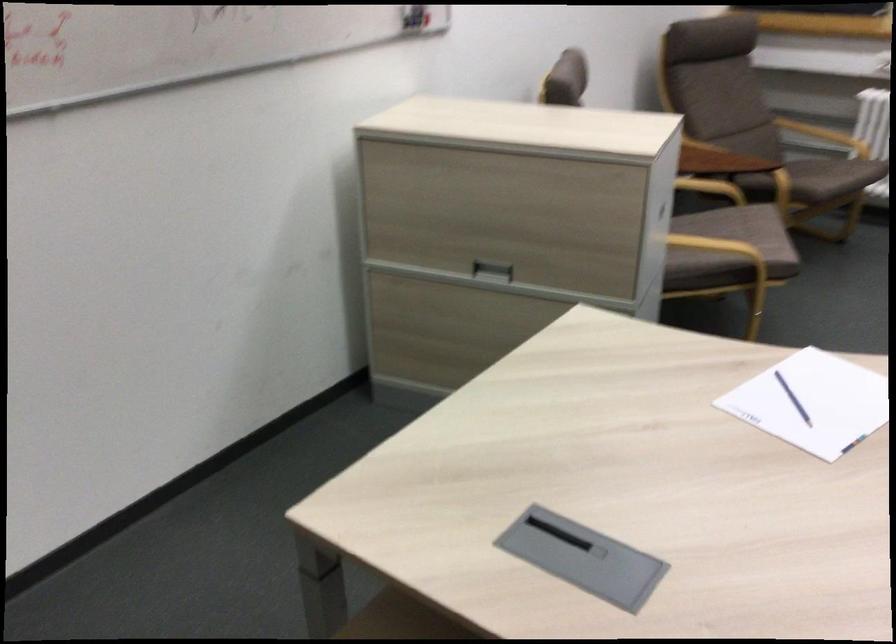
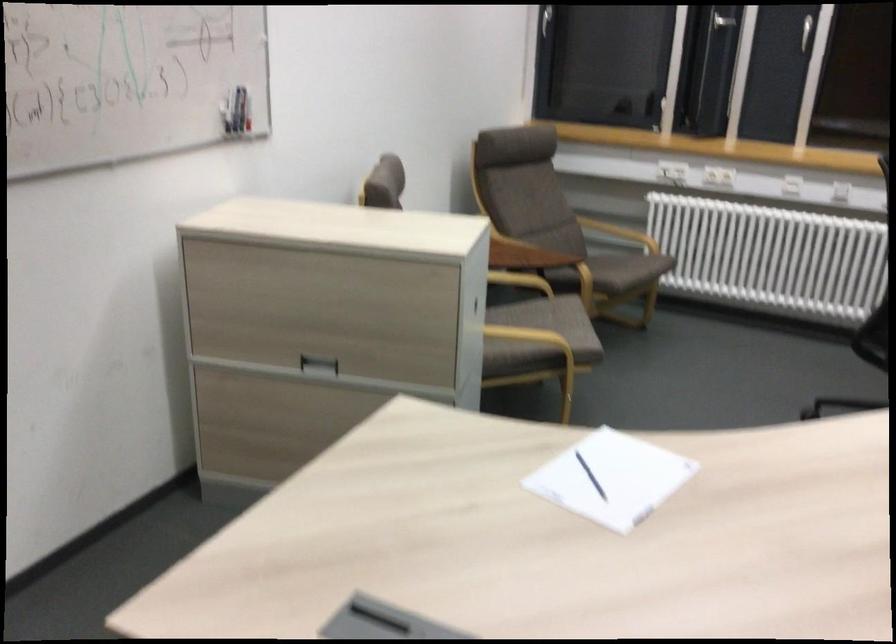
The point at (798,401) is marked in the first image. Where is the corresponding point in the second image?

(590, 476)